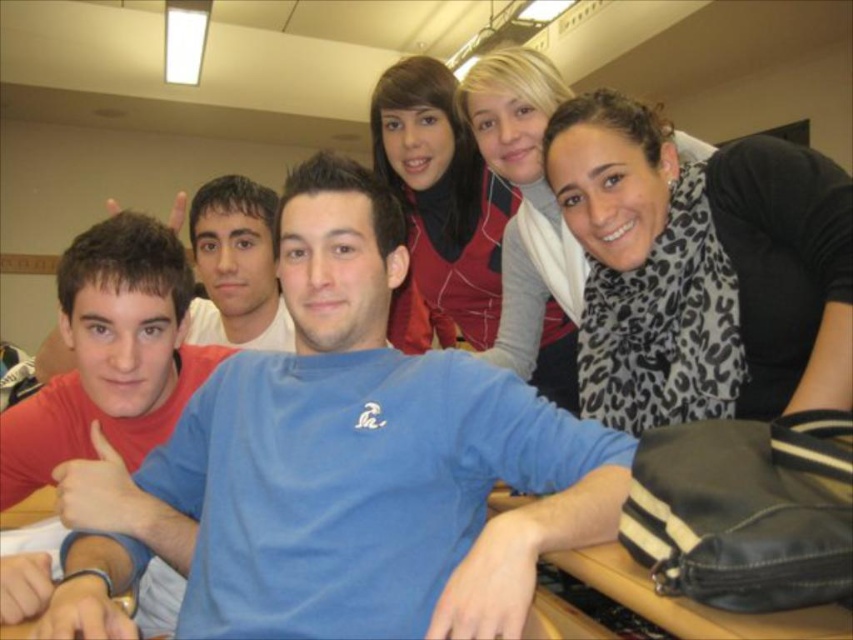
Question: Considering the relative positions of blue cotton shirt at center and matte blue shirt at center in the image provided, where is blue cotton shirt at center located with respect to matte blue shirt at center?

Choices:
 (A) above
 (B) below

Answer: (A)

Question: Does matte red sweater at upper center appear on the right side of matte blue shirt at left?

Choices:
 (A) yes
 (B) no

Answer: (A)

Question: From the image, what is the correct spatial relationship of blue cotton shirt at center in relation to matte blue shirt at left?

Choices:
 (A) right
 (B) left

Answer: (A)

Question: Estimate the real-world distances between objects in this image. Which object is farther from the matte blue shirt at left?

Choices:
 (A) matte red sweater at upper center
 (B) blue cotton shirt at center

Answer: (B)

Question: Which point is farther from the camera taking this photo?

Choices:
 (A) (440, 166)
 (B) (509, 65)
 (C) (61, 349)
 (D) (242, 493)

Answer: (A)

Question: Estimate the real-world distances between objects in this image. Which object is closer to the matte red sweater at upper center?

Choices:
 (A) blue cotton shirt at center
 (B) leopard print scarf at upper right
 (C) matte blue shirt at center
 (D) matte blue shirt at left

Answer: (B)